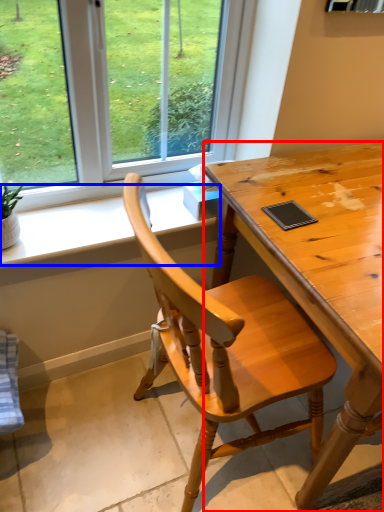
Question: Which point is closer to the camera, desk (highlighted by a red box) or window sill (highlighted by a blue box)?

Choices:
 (A) desk
 (B) window sill

Answer: (A)